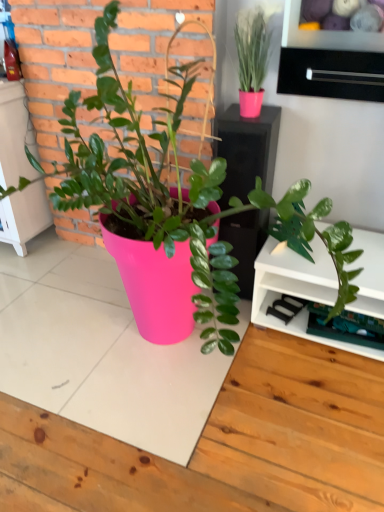
Question: Do you think black matte drawer at upper right is within pink matte pot at center, or outside of it?

Choices:
 (A) outside
 (B) inside

Answer: (B)

Question: From a real-world perspective, is black matte drawer at upper right physically located above or below pink matte pot at center?

Choices:
 (A) below
 (B) above

Answer: (B)

Question: Relative to pink matte pot at center, is black matte drawer at upper right in front or behind?

Choices:
 (A) behind
 (B) front

Answer: (A)

Question: Is pink matte pot at center situated inside black matte drawer at upper right or outside?

Choices:
 (A) inside
 (B) outside

Answer: (B)

Question: From a real-world perspective, is pink matte pot at center above or below black matte drawer at upper right?

Choices:
 (A) above
 (B) below

Answer: (B)

Question: Is pink matte pot at center bigger or smaller than black matte drawer at upper right?

Choices:
 (A) small
 (B) big

Answer: (B)

Question: Relative to black matte drawer at upper right, is pink matte pot at center in front or behind?

Choices:
 (A) front
 (B) behind

Answer: (A)